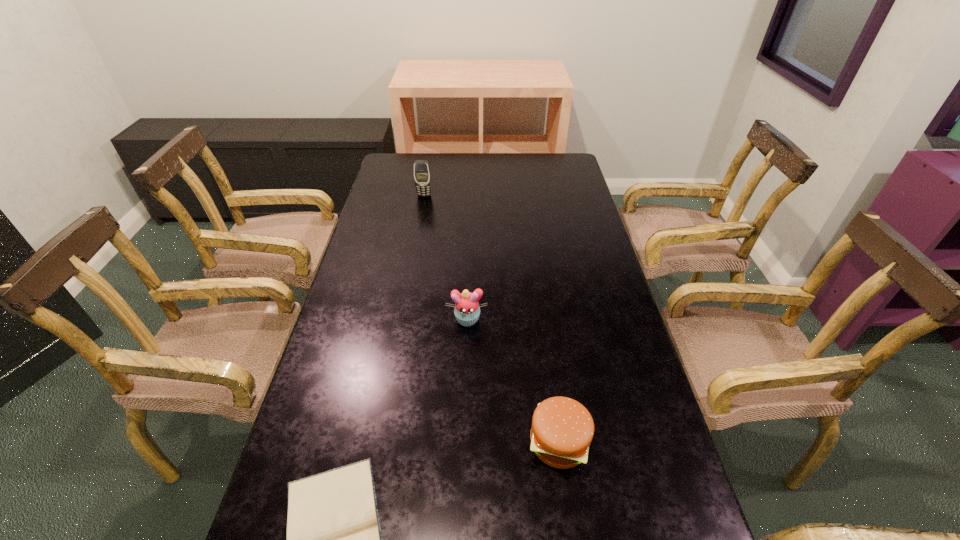
Select which object appears as the closest to the cellular telephone. Please provide its 2D coordinates. Your answer should be formatted as a tuple, i.e. [(x, y)], where the tuple contains the x and y coordinates of a point satisfying the conditions above.

[(467, 311)]

Find the location of a particular element. Image resolution: width=960 pixels, height=540 pixels. free space that satisfies the following two spatial constraints: 1. on the front face of the third tallest object; 2. on the left side of the cellular telephone is located at coordinates (381, 442).

Image resolution: width=960 pixels, height=540 pixels. What are the coordinates of `free space that satisfies the following two spatial constraints: 1. on the face of the cupcake; 2. on the left side of the hamburger` in the screenshot? It's located at (464, 442).

This screenshot has width=960, height=540. I want to click on free space in the image that satisfies the following two spatial constraints: 1. on the face of the third tallest object; 2. on the left side of the second farthest object, so click(x=464, y=442).

Identify the location of free spot that satisfies the following two spatial constraints: 1. on the front face of the farthest object; 2. on the right side of the hamburger. This screenshot has height=540, width=960. (381, 442).

Where is `vacant space that satisfies the following two spatial constraints: 1. on the face of the second shortest object; 2. on the right side of the second farthest object`? vacant space that satisfies the following two spatial constraints: 1. on the face of the second shortest object; 2. on the right side of the second farthest object is located at coordinates (464, 442).

Locate an element on the screen. The image size is (960, 540). free point that satisfies the following two spatial constraints: 1. on the front face of the tallest object; 2. on the left side of the rightmost object is located at coordinates (381, 442).

At what (x,y) coordinates should I click in order to perform the action: click on vacant region that satisfies the following two spatial constraints: 1. on the face of the hamburger; 2. on the right side of the cupcake. Please return your answer as a coordinate pair (x, y). The height and width of the screenshot is (540, 960). Looking at the image, I should click on (464, 442).